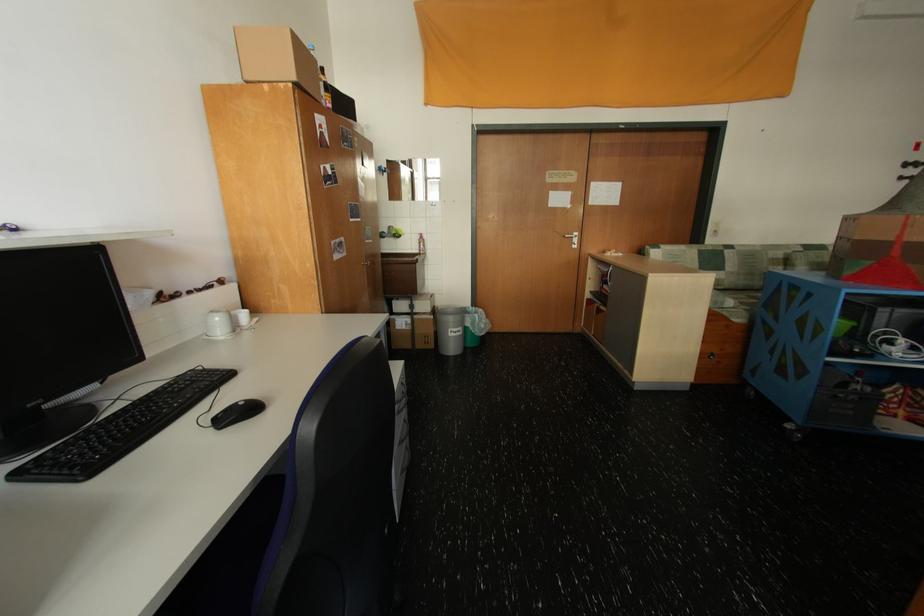
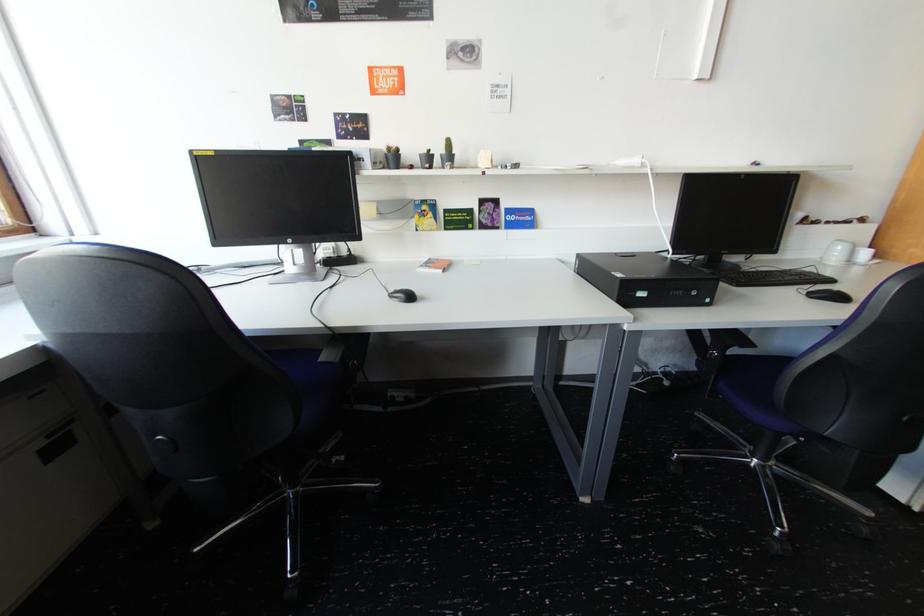
Locate, in the second image, the point that corresponds to point (244, 406) in the first image.

(839, 291)